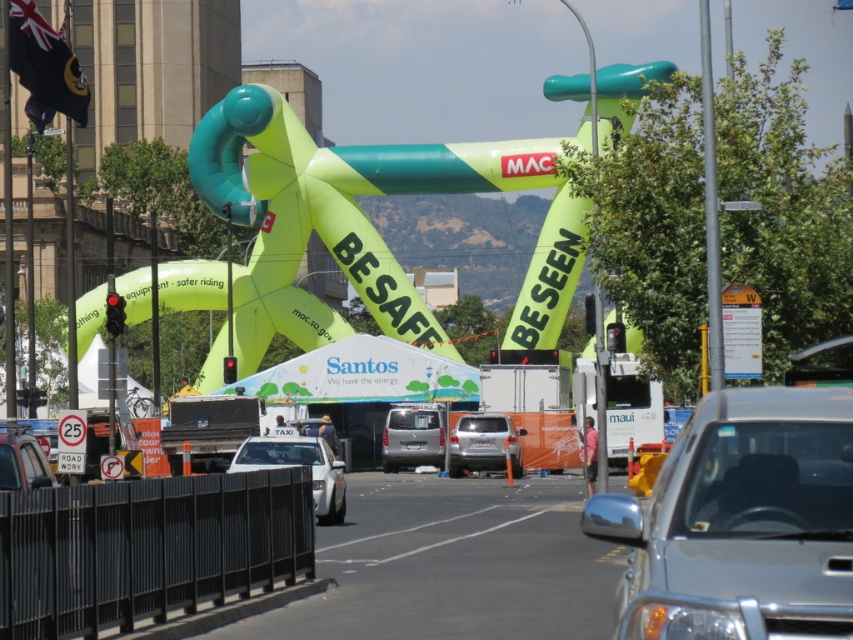
Question: Does green inflatable bicycle at center appear over silver metallic car at center?

Choices:
 (A) yes
 (B) no

Answer: (A)

Question: Estimate the real-world distances between objects in this image. Which object is farther from the satin silver suv at center?

Choices:
 (A) silver metallic van at center
 (B) white glossy taxi at center
 (C) metallic silver car at lower left
 (D) orange plastic sign at upper right

Answer: (C)

Question: Is orange plastic sign at upper right thinner than white plastic sign at center?

Choices:
 (A) no
 (B) yes

Answer: (B)

Question: Observing the image, what is the correct spatial positioning of silver metallic car at center in reference to white plastic sign at center?

Choices:
 (A) left
 (B) right

Answer: (B)

Question: Which of the following is the farthest from the observer?

Choices:
 (A) white plastic sign at center
 (B) metallic silver car at lower left

Answer: (A)

Question: Which object is closer to the camera taking this photo?

Choices:
 (A) white plastic sign at center
 (B) orange plastic sign at upper right
 (C) silver metallic van at center

Answer: (B)